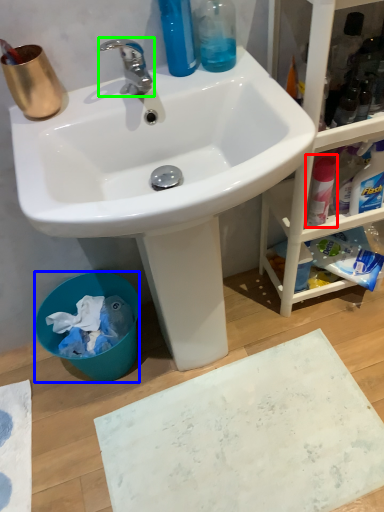
Question: Based on their relative distances, which object is farther from cleaning product (highlighted by a red box)? Choose from trash bin/can (highlighted by a blue box) and tap (highlighted by a green box).

Choices:
 (A) trash bin/can
 (B) tap

Answer: (A)